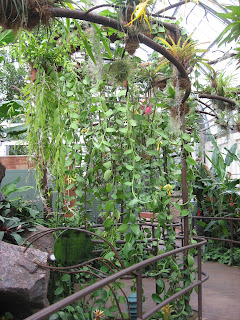
Find the location of a particular element. This screenshot has width=240, height=320. tropical plant right side is located at coordinates (221, 187), (207, 184), (72, 227).